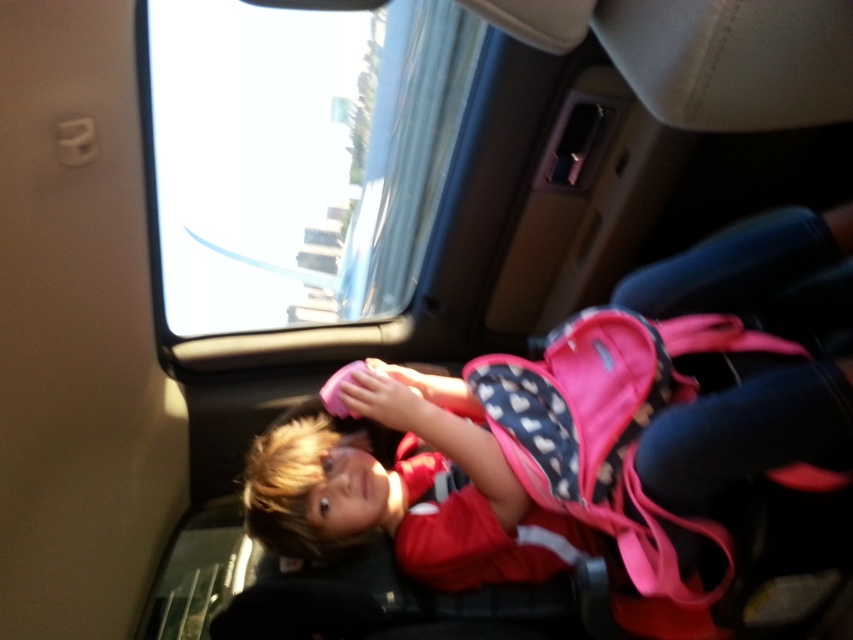
You are a flight attendant checking the safety harness of the child. The harness is attached to the seat at point (225, 83). If the harness has a maximum extension of 1.8 meters, can the child reach the window which is 1.90 meters away from the camera?

The point (225, 83) where the harness is attached is 1.90 meters from the camera, which is beyond the harness maximum extension of 1.8 meters. Therefore, the child cannot reach the window.

From the picture: You are sitting in the airplane cabin and want to know which of the two points, point (212, 42) or point (300, 500), is closer to you. Based on the image, which one is nearer?

Point (212, 42) is further to the viewer than point (300, 500). Wait, the question asks which is closer to you. The description says point (212, 42) is further to the viewer, meaning it is farther away. Therefore, point (300, 500) is closer.

You are a flight attendant checking the cabin. You notice the transparent glass window at upper center and the pink fabric backpack at center. Which object is closer to you?

The transparent glass window at upper center is closer to you because it is further to the viewer than the pink fabric backpack at center.